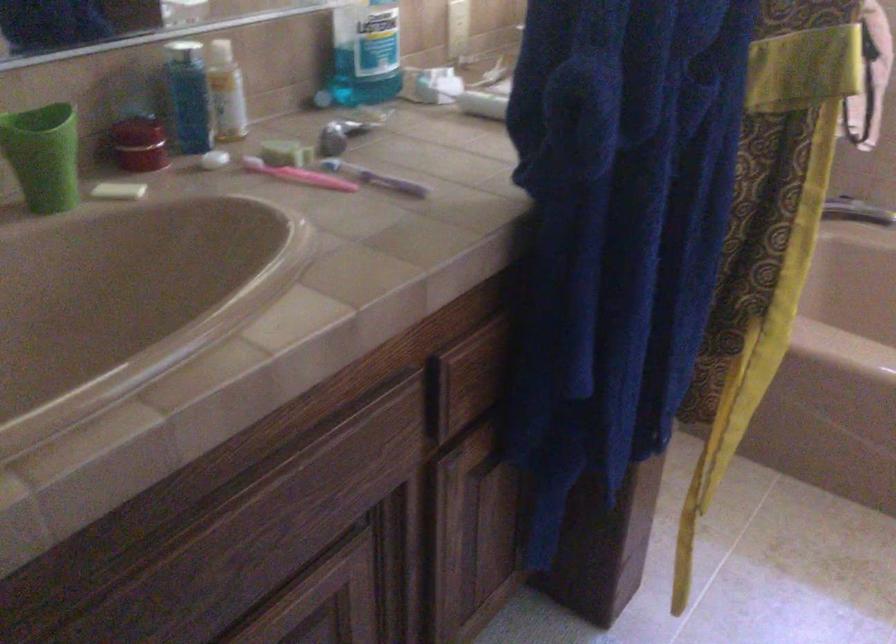
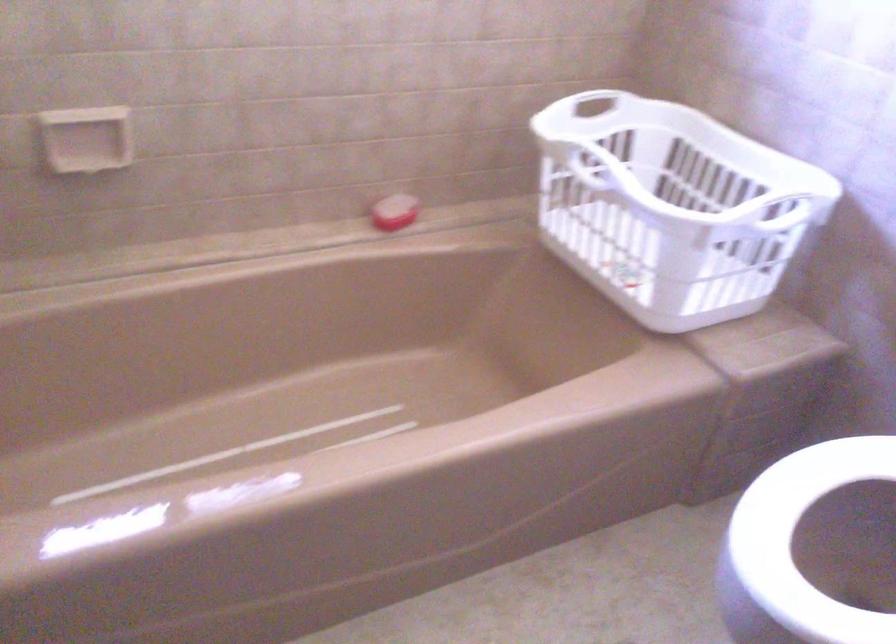
Based on the photo, first-person continuous shooting, in which direction is the camera rotating?

The rotation direction of the camera is right-down.